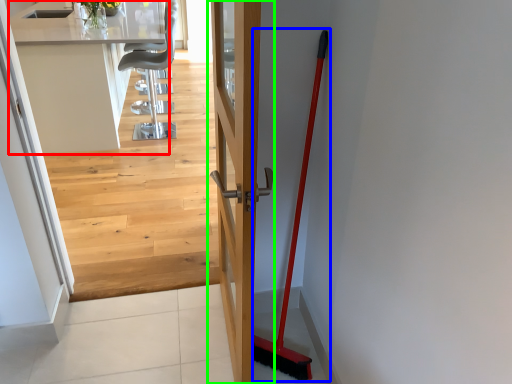
Question: Considering the real-world distances, which object is closest to counter top (highlighted by a red box)? shovel (highlighted by a blue box) or door (highlighted by a green box).

Choices:
 (A) shovel
 (B) door

Answer: (B)